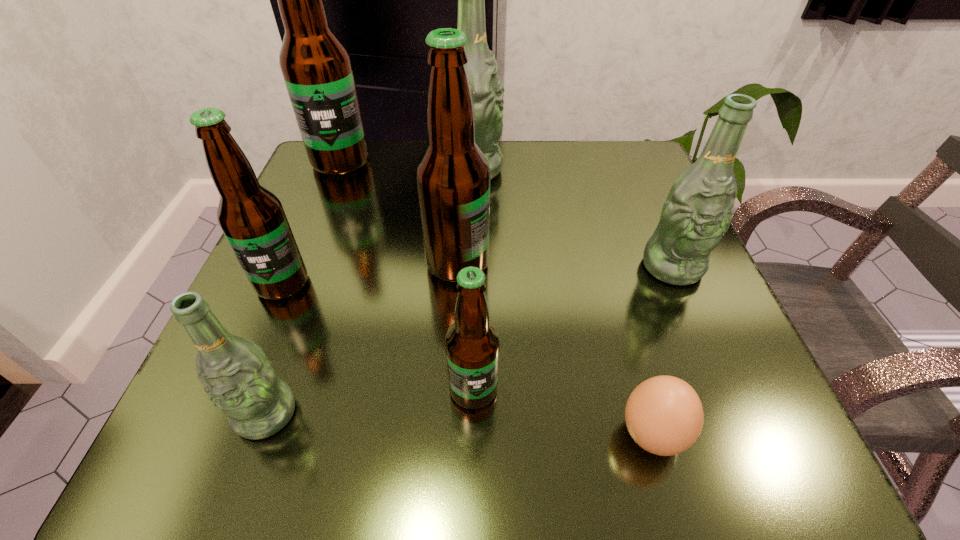
Locate an element on the screen. The image size is (960, 540). the nearest green beer bottle is located at coordinates (239, 379).

Locate an element on the screen. This screenshot has width=960, height=540. the seventh object from left to right is located at coordinates (664, 415).

In order to click on the shortest object in this screenshot , I will do `click(664, 415)`.

The height and width of the screenshot is (540, 960). Find the location of `free space located 0.310m on the label of the tallest beer bottle`. free space located 0.310m on the label of the tallest beer bottle is located at coordinates (292, 282).

Where is `free space located 0.070m on the surface of the second green beer bottle from right to left`? This screenshot has height=540, width=960. free space located 0.070m on the surface of the second green beer bottle from right to left is located at coordinates (534, 169).

Where is `free space located on the label of the third smallest brown beer bottle`? This screenshot has height=540, width=960. free space located on the label of the third smallest brown beer bottle is located at coordinates (534, 264).

Find the location of `free space located on the surface of the rightmost green beer bottle`. free space located on the surface of the rightmost green beer bottle is located at coordinates (744, 434).

Where is `vacant space located 0.060m on the label of the third biggest brown beer bottle`? vacant space located 0.060m on the label of the third biggest brown beer bottle is located at coordinates (261, 333).

At what (x,y) coordinates should I click in order to perform the action: click on free space located on the label of the smallest brown beer bottle. Please return your answer as a coordinate pair (x, y). The width and height of the screenshot is (960, 540). Looking at the image, I should click on (472, 466).

Image resolution: width=960 pixels, height=540 pixels. What are the coordinates of `vacant space located 0.120m on the back of the brown boiled egg` in the screenshot? It's located at (623, 332).